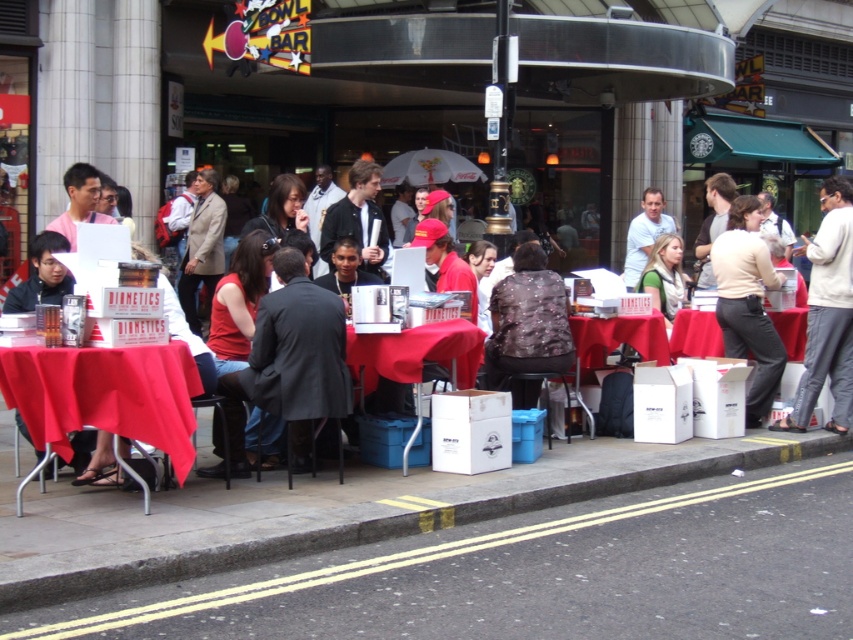
Question: Can you confirm if red cloth table at center is bigger than red fabric table at center?

Choices:
 (A) yes
 (B) no

Answer: (A)

Question: Does red cloth table at left come in front of red cloth table at center?

Choices:
 (A) yes
 (B) no

Answer: (A)

Question: Which object is positioned farthest from the smooth asphalt road at lower center?

Choices:
 (A) red fabric table at center
 (B) red cloth table at left

Answer: (A)

Question: Considering the real-world distances, which object is farthest from the light beige sweater at center?

Choices:
 (A) white cardboard box at lower center
 (B) smooth asphalt road at lower center
 (C) red fabric table at center

Answer: (B)

Question: Which object is closer to the camera taking this photo?

Choices:
 (A) red cloth table at left
 (B) smooth asphalt road at lower center
 (C) red cloth table at center
 (D) red fabric table at center

Answer: (B)

Question: Does smooth asphalt road at lower center lie behind red cloth table at center?

Choices:
 (A) no
 (B) yes

Answer: (A)